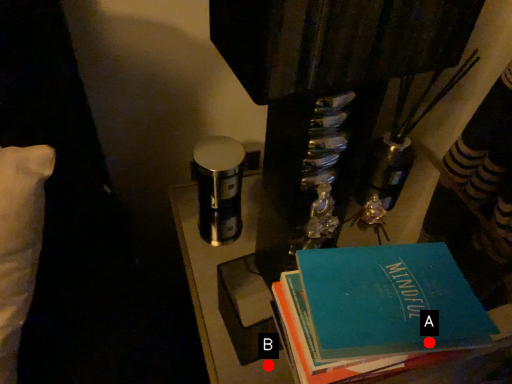
Question: Two points are circled on the image, labeled by A and B beside each circle. Which of the following is the closest to the observer?

Choices:
 (A) A is closer
 (B) B is closer

Answer: (A)